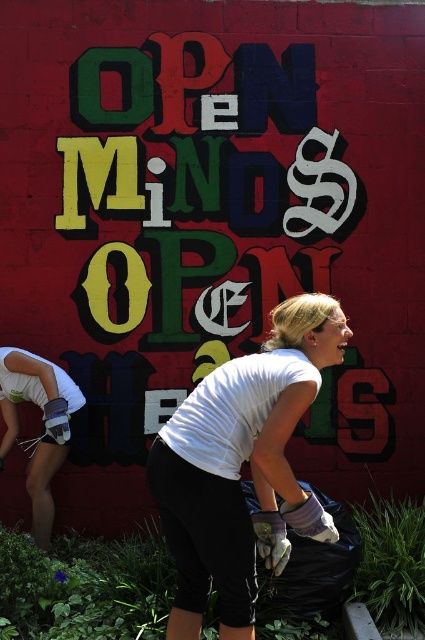
Which of these two, white matte shirt at center or white matte gloves at lower left, stands shorter?

white matte gloves at lower left

Does white matte shirt at center lie in front of white matte gloves at lower left?

Yes, it is in front of white matte gloves at lower left.

Find the location of a particular element. The width and height of the screenshot is (425, 640). white matte shirt at center is located at coordinates (240, 465).